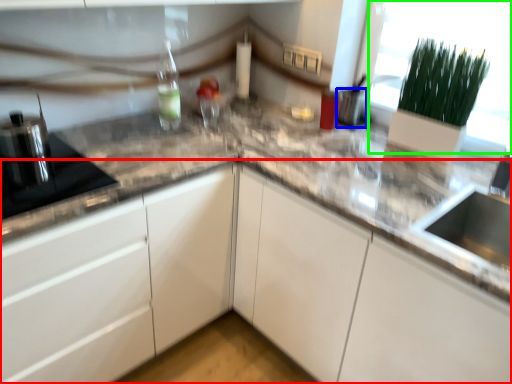
Question: Considering the real-world distances, which object is closest to cabinetry (highlighted by a red box)? appliance (highlighted by a blue box) or glass door (highlighted by a green box).

Choices:
 (A) appliance
 (B) glass door

Answer: (B)